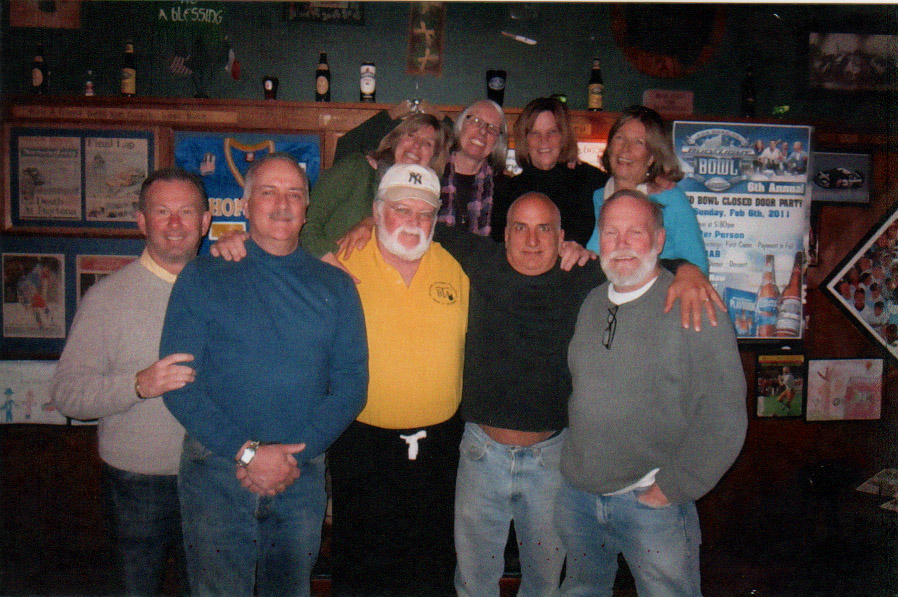
Locate an element on the screen. grey wall is located at coordinates (367, 45).